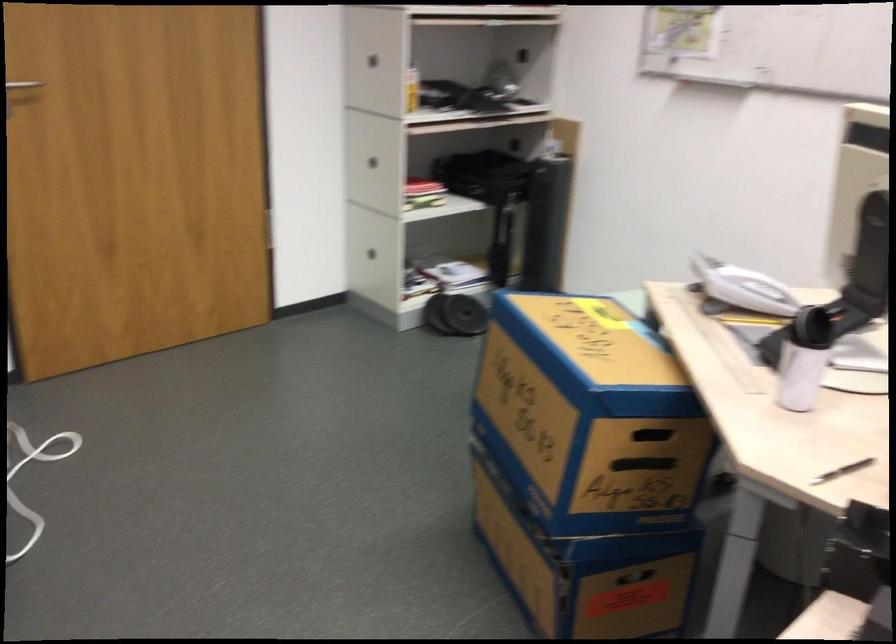
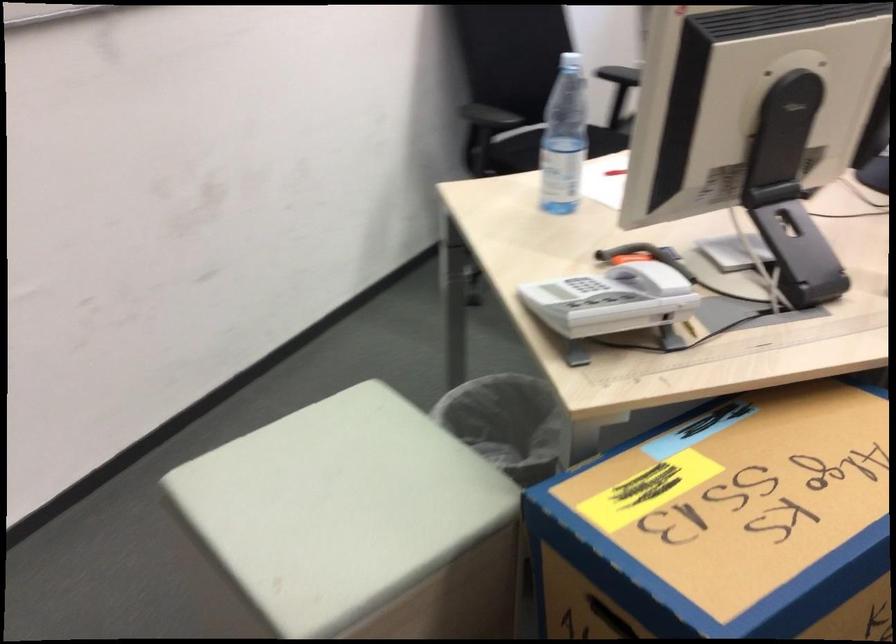
Question: I am providing you with two images of the same scene from different viewpoints. Which of the following objects are not visible in image2?

Choices:
 (A) transparent ruler
 (B) white telephone handset
 (C) plastic water bottle
 (D) none of these

Answer: (D)